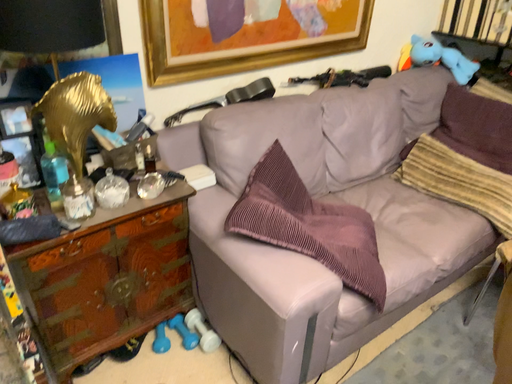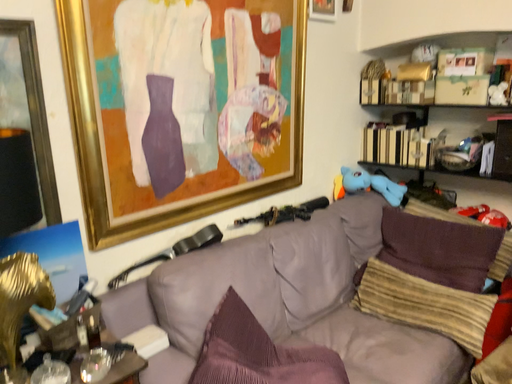
Question: How did the camera likely rotate when shooting the video?

Choices:
 (A) rotated upward
 (B) rotated downward

Answer: (A)